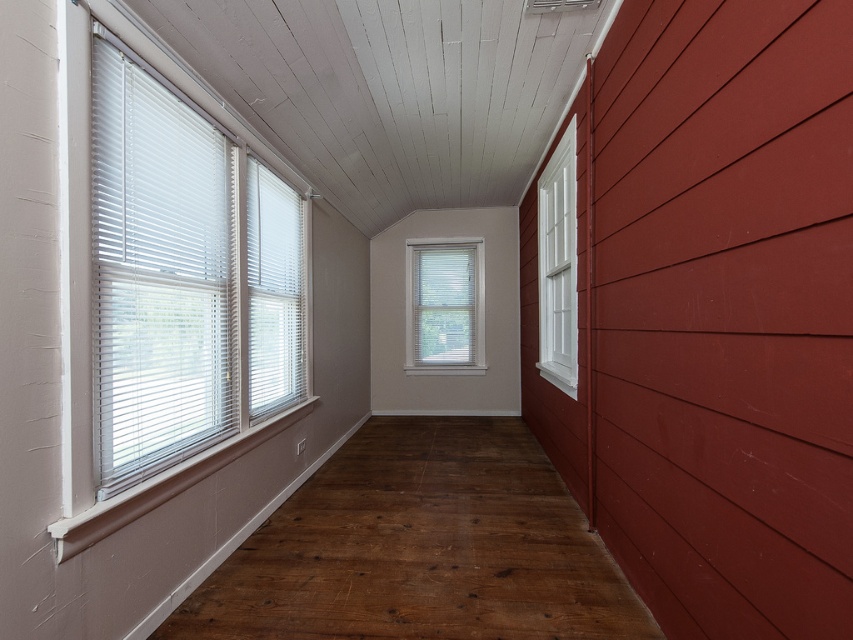
Question: Which object appears closest to the camera in this image?

Choices:
 (A) white matte window at center
 (B) dark brown wood floor at left

Answer: (B)

Question: Estimate the real-world distances between objects in this image. Which object is closer to the white painted wood window at right?

Choices:
 (A) white matte window at center
 (B) white blinds at left
 (C) dark brown wood floor at left

Answer: (C)

Question: Which point is closer to the camera?

Choices:
 (A) white blinds at left
 (B) white painted wood window at right
 (C) white matte window at center

Answer: (A)

Question: From the image, what is the correct spatial relationship of dark brown wood floor at left in relation to white blinds at left?

Choices:
 (A) left
 (B) right

Answer: (B)

Question: Is dark brown wood floor at left to the left of white blinds at left from the viewer's perspective?

Choices:
 (A) yes
 (B) no

Answer: (B)

Question: Does white blinds at left come behind white painted wood window at right?

Choices:
 (A) yes
 (B) no

Answer: (B)